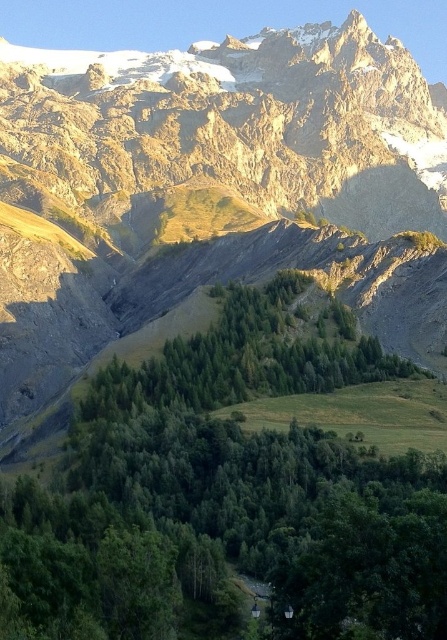
You are a hiker planning to take a photo of the rugged stone mountain at upper center and the green leafy trees at center. Which object will appear wider in the photo?

The rugged stone mountain at upper center will appear wider in the photo since its width surpasses that of the green leafy trees at center as stated in the description.

You are standing at the base of the rugged stone mountain at upper center and want to reach the summit. If your average walking speed is 3 km per hour, how long would it take you to climb to the top?

The rugged stone mountain at upper center is 124.29 meters away from viewer. Assuming the distance to the summit is approximately 124.29 meters, at a walking speed of 3 km per hour, it would take roughly 2.5 minutes to reach the top.